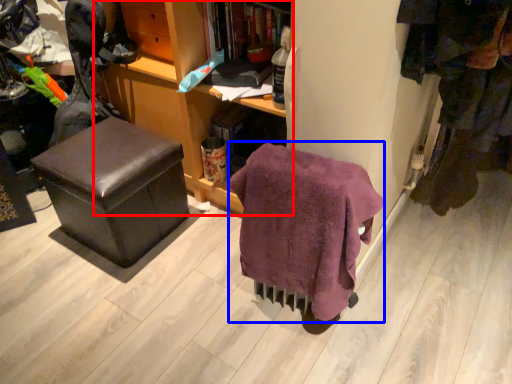
Question: Which of the following is the closest to the observer, cabinetry (highlighted by a red box) or blanket (highlighted by a blue box)?

Choices:
 (A) cabinetry
 (B) blanket

Answer: (B)